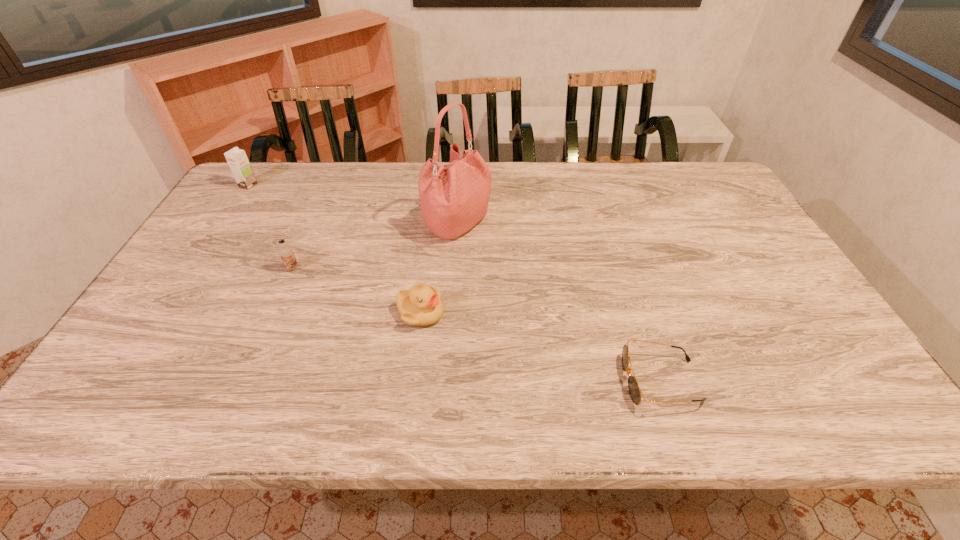
Where is `the tallest object`? the tallest object is located at coordinates (454, 197).

Where is `handbag`? handbag is located at coordinates (454, 197).

You are a GUI agent. You are given a task and a screenshot of the screen. Output one action in this format:
    pyautogui.click(x=<x>, y=<y>)
    Task: Click on the farthest object
    This screenshot has width=960, height=540.
    Given the screenshot: What is the action you would take?
    pyautogui.click(x=237, y=159)

The width and height of the screenshot is (960, 540). In order to click on the farther chocolate milk in this screenshot , I will do `click(237, 159)`.

Identify the location of the second object from left to right. (286, 252).

This screenshot has height=540, width=960. I want to click on the nearer chocolate milk, so click(x=286, y=252).

Identify the location of duckling. (421, 306).

Locate an element on the screen. the shortest object is located at coordinates (635, 393).

Find the location of a particular element. The width and height of the screenshot is (960, 540). the nearest object is located at coordinates (635, 393).

Locate an element on the screen. Image resolution: width=960 pixels, height=540 pixels. vacant point located on the right of the handbag is located at coordinates (534, 224).